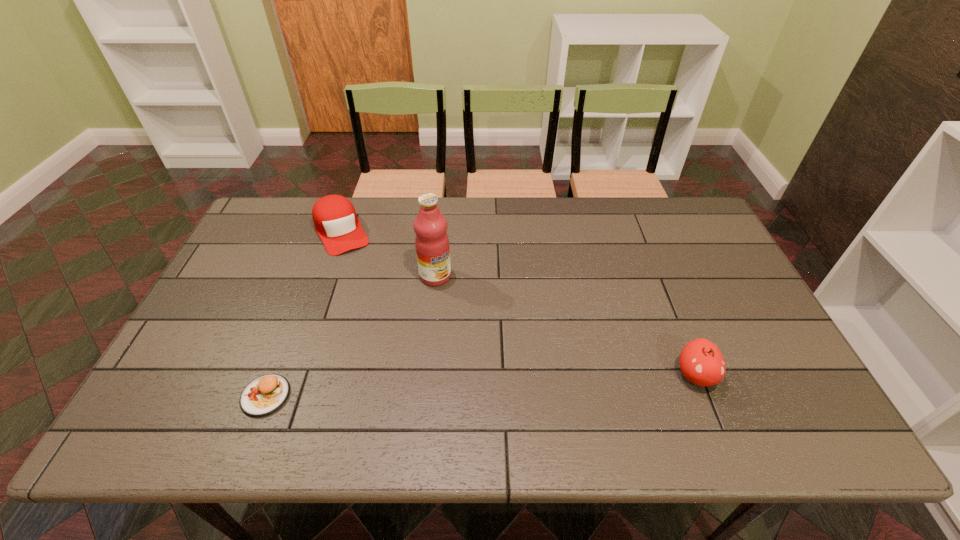
The height and width of the screenshot is (540, 960). I want to click on the shortest object, so click(265, 394).

This screenshot has width=960, height=540. Identify the location of apple. (701, 362).

Locate an element on the screen. the third object from left to right is located at coordinates (430, 226).

You are a GUI agent. You are given a task and a screenshot of the screen. Output one action in this format:
    pyautogui.click(x=<x>, y=<y>)
    Task: Click on the second farthest object
    
    Given the screenshot: What is the action you would take?
    pyautogui.click(x=430, y=226)

I want to click on the farthest object, so click(335, 220).

The image size is (960, 540). What are the coordinates of `free spot located on the right of the patty` in the screenshot? It's located at pyautogui.click(x=388, y=396).

Where is `vacant space located 0.150m on the back of the rightmost object`? This screenshot has width=960, height=540. vacant space located 0.150m on the back of the rightmost object is located at coordinates (670, 310).

I want to click on free location located 0.110m on the label of the second farthest object, so click(x=461, y=310).

Where is `vacant space located on the label of the second farthest object`? This screenshot has height=540, width=960. vacant space located on the label of the second farthest object is located at coordinates (498, 361).

Locate an element on the screen. The image size is (960, 540). vacant space located on the label of the second farthest object is located at coordinates 507,373.